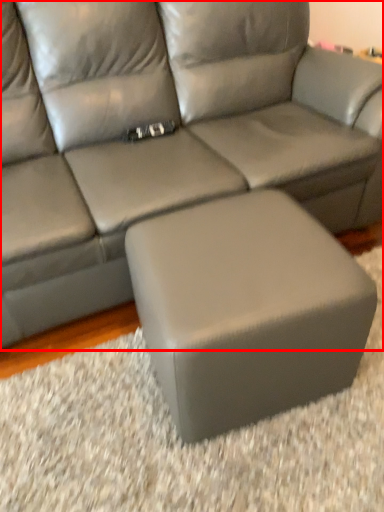
Question: From the image's perspective, considering the relative positions of studio couch (annotated by the red box) and stool in the image provided, where is studio couch (annotated by the red box) located with respect to the staircase?

Choices:
 (A) below
 (B) above

Answer: (B)